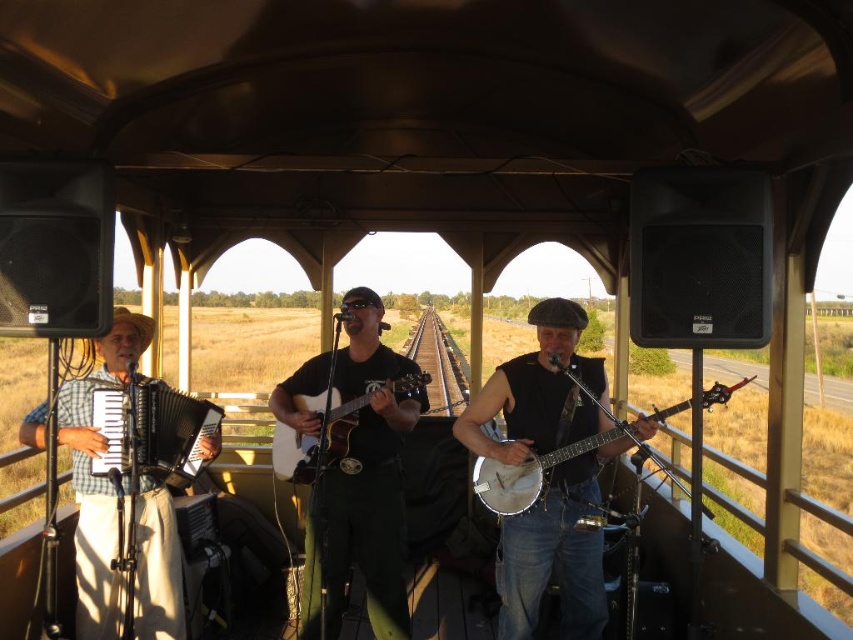
You are a photographer standing at the center of the train car. You want to take a photo of the matte black accordion at left. Which direction should you move to get a better shot?

Since the matte black accordion at left is located at point (151, 429), you should move to the left side of the train car to get a better shot.

From the picture: You are a photographer standing in front of the train car. You want to take a photo of the matte black accordion at left and the matte brown acoustic guitar at center. Which instrument will appear larger in your photo?

The matte black accordion at left appears larger in the photo because it is closer to the viewer than the matte brown acoustic guitar at center.